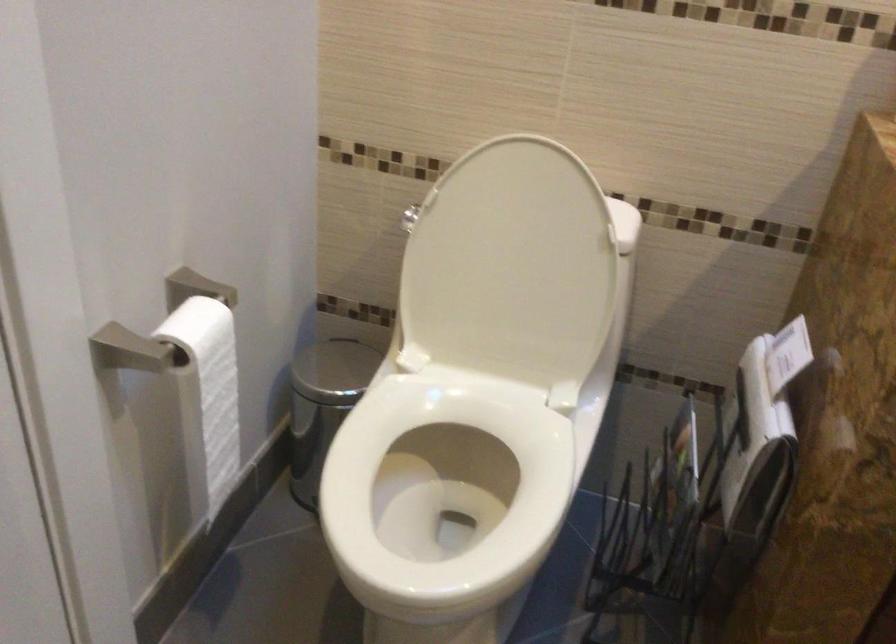
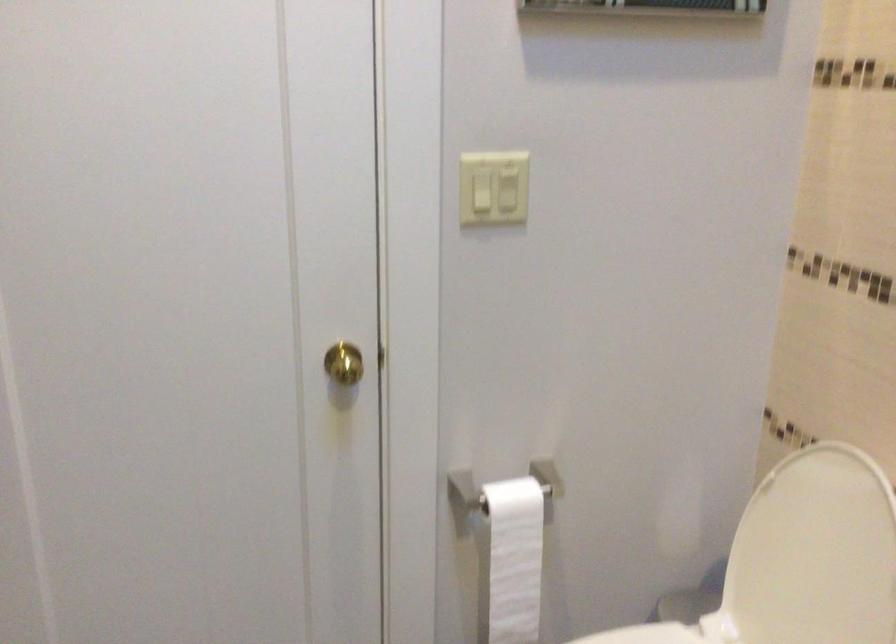
In the second image, find the point that corresponds to (x=375, y=402) in the first image.

(645, 635)